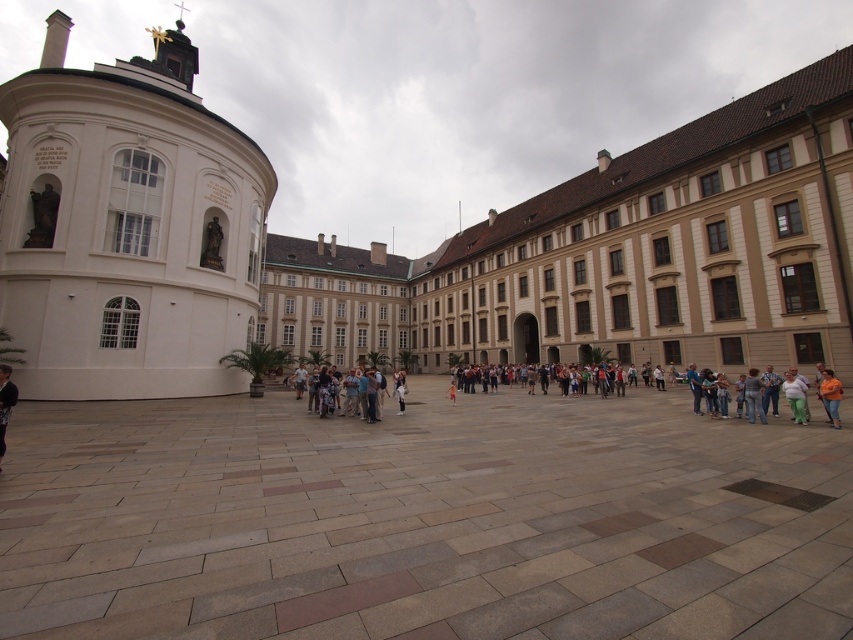
Looking at this image, you are standing in the courtyard and want to take a photo of the white smooth dome at left. If you are currently facing north, which direction should you turn to ensure the dome is in the center of your camera frame?

Since the white smooth dome at left is positioned at point 0.355 on the x and 0.150 on the y coordinates, you should turn to the left to center it in your camera frame while facing north.

From the picture: You are a fashion designer observing the courtyard scene. You notice the light brown leather jacket at center and the dark blue jeans at lower left. Which item of clothing is bigger in size?

Answer: The light brown leather jacket at center is larger in size compared to the dark blue jeans at lower left.